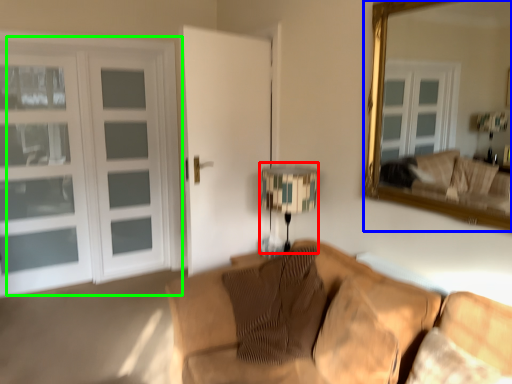
Question: Which object is the closest to the table lamp (highlighted by a red box)? Choose among these: mirror (highlighted by a blue box) or door (highlighted by a green box).

Choices:
 (A) mirror
 (B) door

Answer: (A)